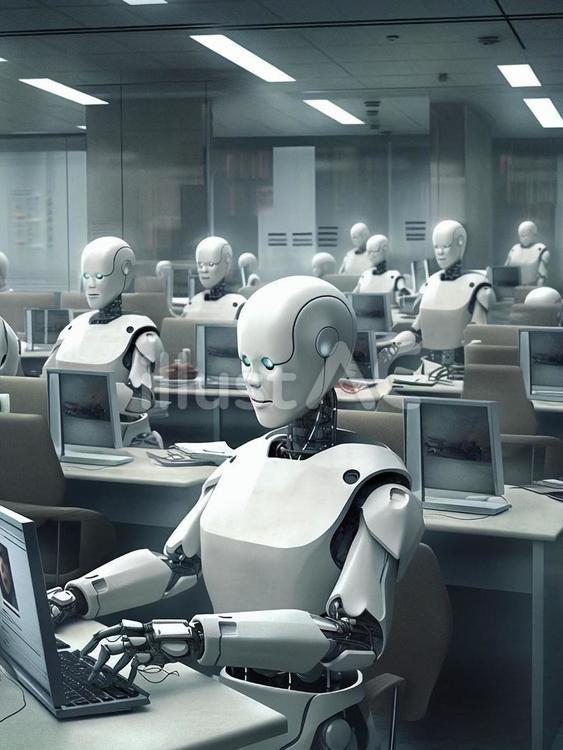
Identify the location of computer. (26, 616), (73, 409), (426, 441), (547, 357), (367, 346), (372, 310), (208, 349), (35, 322), (183, 280), (510, 271).